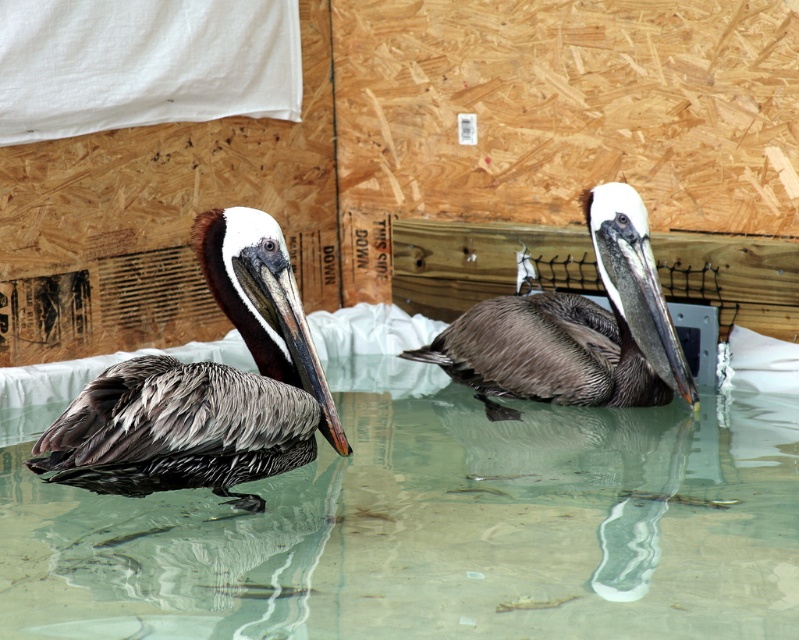
Does brown feathered pelican at left lie behind brown feathered pelican at center?

No, it is not.

Consider the image. Which is above, brown feathered pelican at left or brown feathered pelican at center?

brown feathered pelican at center is higher up.

Identify the location of brown feathered pelican at left. (205, 387).

I want to click on brown feathered pelican at left, so click(205, 387).

Is clear water at center wider than brown feathered pelican at left?

Indeed, clear water at center has a greater width compared to brown feathered pelican at left.

Does clear water at center appear on the left side of brown feathered pelican at left?

Incorrect, clear water at center is not on the left side of brown feathered pelican at left.

Between point (372, 612) and point (257, 221), which one is positioned behind?

Point (257, 221)

You are a GUI agent. You are given a task and a screenshot of the screen. Output one action in this format:
    pyautogui.click(x=<x>, y=<y>)
    Task: Click on the clear water at center
    This screenshot has height=640, width=799.
    Given the screenshot: What is the action you would take?
    pyautogui.click(x=436, y=529)

Is the position of clear water at center more distant than that of brown feathered pelican at center?

No, clear water at center is in front of brown feathered pelican at center.

Does point (648, 584) come farther from viewer compared to point (466, 356)?

No.

The image size is (799, 640). What are the coordinates of `clear water at center` in the screenshot? It's located at (436, 529).